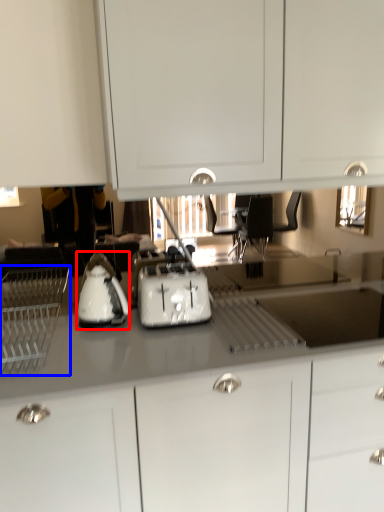
Question: Among these objects, which one is farthest to the camera, kitchen appliance (highlighted by a red box) or home appliance (highlighted by a blue box)?

Choices:
 (A) kitchen appliance
 (B) home appliance

Answer: (A)